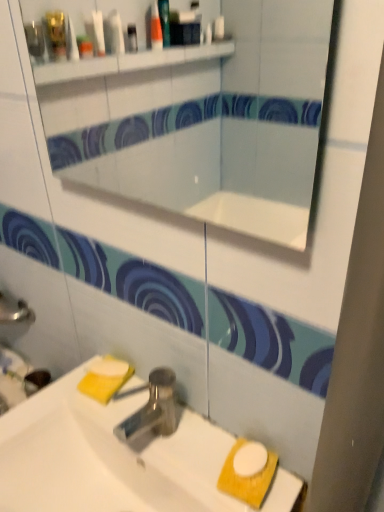
At what (x,y) coordinates should I click in order to perform the action: click on vacant space to the right of polished metallic tap at center. Please return your answer as a coordinate pair (x, y). Looking at the image, I should click on (205, 449).